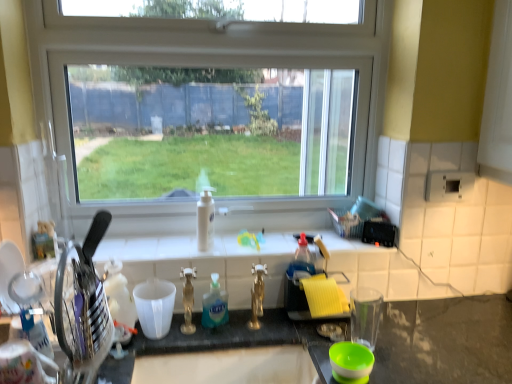
Question: Is metallic knife block at left, which is the second appliance from right to left, smaller than transparent glass window at center?

Choices:
 (A) no
 (B) yes

Answer: (B)

Question: Is metallic knife block at left, the 1th appliance in the left-to-right sequence, oriented away from transparent glass window at center?

Choices:
 (A) no
 (B) yes

Answer: (A)

Question: Are metallic knife block at left, which is the 1th appliance from front to back, and transparent glass window at center located far from each other?

Choices:
 (A) no
 (B) yes

Answer: (A)

Question: Considering the relative sizes of metallic knife block at left, the 1th appliance in the left-to-right sequence, and transparent glass window at center in the image provided, is metallic knife block at left, the 1th appliance in the left-to-right sequence, thinner than transparent glass window at center?

Choices:
 (A) no
 (B) yes

Answer: (A)

Question: From the image's perspective, would you say metallic knife block at left, which is the 1th appliance from front to back, is shown under transparent glass window at center?

Choices:
 (A) no
 (B) yes

Answer: (B)

Question: From a real-world perspective, is translucent plastic bottle at center, the first bottle in the front-to-back sequence, physically located above or below yellow sponge at right, the 2th appliance positioned from the front?

Choices:
 (A) below
 (B) above

Answer: (A)

Question: Does point (221, 304) appear closer or farther from the camera than point (288, 286)?

Choices:
 (A) farther
 (B) closer

Answer: (B)

Question: Considering their positions, is translucent plastic bottle at center, the first bottle in the front-to-back sequence, located in front of or behind yellow sponge at right, marked as the 2th appliance in a left-to-right arrangement?

Choices:
 (A) behind
 (B) front

Answer: (A)

Question: Is translucent plastic bottle at center, which is the 2th bottle from back to front, bigger or smaller than yellow sponge at right, the 2th appliance positioned from the front?

Choices:
 (A) big
 (B) small

Answer: (B)

Question: Is transparent glass window at center inside or outside of yellow sponge at right, positioned as the 1th appliance in back-to-front order?

Choices:
 (A) outside
 (B) inside

Answer: (A)

Question: Is point (76, 213) positioned closer to the camera than point (295, 289)?

Choices:
 (A) closer
 (B) farther

Answer: (B)

Question: From a real-world perspective, is transparent glass window at center positioned above or below yellow sponge at right, positioned as the 1th appliance in back-to-front order?

Choices:
 (A) above
 (B) below

Answer: (A)

Question: Looking at their shapes, would you say transparent glass window at center is wider or thinner than yellow sponge at right, marked as the 2th appliance in a left-to-right arrangement?

Choices:
 (A) wide
 (B) thin

Answer: (B)

Question: Based on their positions, is yellow sponge at right, the 2th appliance positioned from the front, located to the left or right of transparent glass window at center?

Choices:
 (A) right
 (B) left

Answer: (A)

Question: From the image's perspective, relative to transparent glass window at center, is yellow sponge at right, marked as the 2th appliance in a left-to-right arrangement, above or below?

Choices:
 (A) below
 (B) above

Answer: (A)